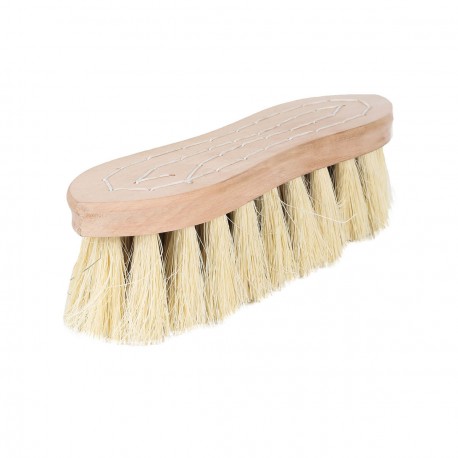
Where is `light`? The height and width of the screenshot is (458, 458). light is located at coordinates (182, 205).